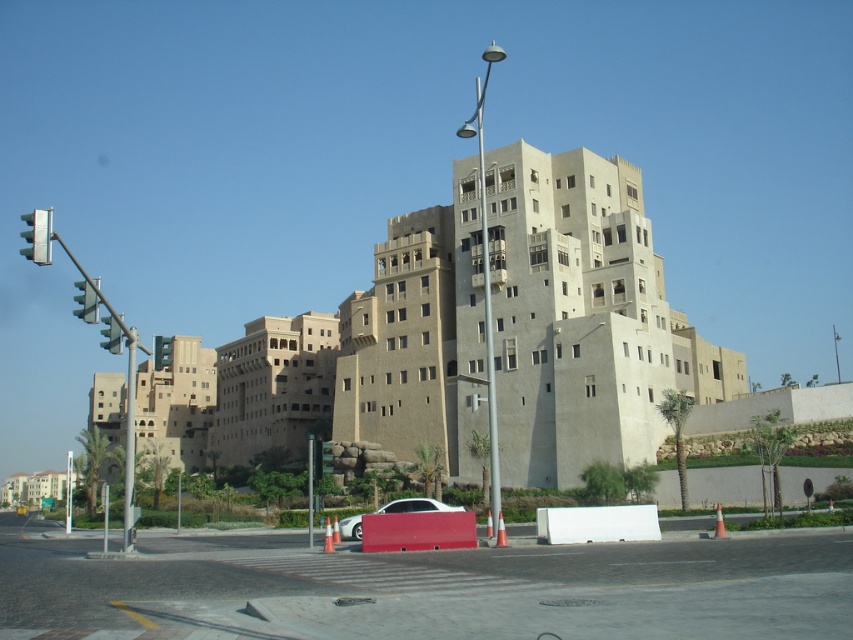
Based on the photo, you are standing at the pedestrian crossing on the paved road in front of the multi story building. You need to reach the entrance of the building which is directly behind the metallic traffic light at left. Which direction should you walk to reach the entrance?

The entrance of the building is directly behind the metallic traffic light at left, so you should walk towards the metallic traffic light at left to reach the entrance.

You are a pedestrian standing on the sidewalk and see both the green metallic traffic light at left and the green glass traffic light at left. Which one is more to the left?

The green metallic traffic light at left is more to the left than the green glass traffic light at left.